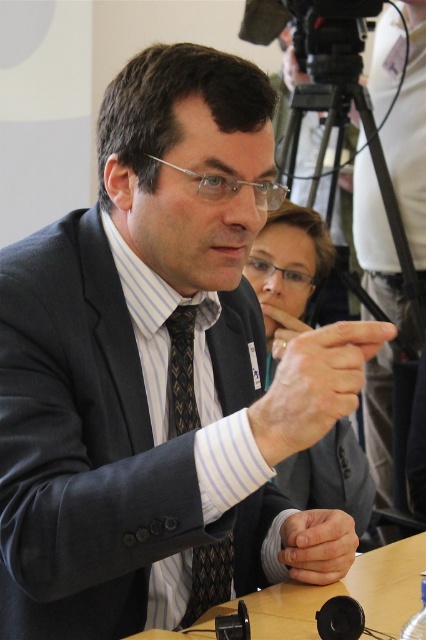
Based on the photo, you are a photographer at the event. You need to capture a closeup shot of the white matte hand at center and the black textured tie at center. Which object is wider in the photo?

The white matte hand at center is wider than the black textured tie at center.

You are a photographer at a conference. You need to capture a photo of the matte black suit at center and the smooth skin hands at center. Can you fit both subjects in the frame if the camera has a standard 50mm lens with a field of view that can capture objects up to 1.8 meters in height?

The matte black suit at center is much taller than the smooth skin hands at center. Since the camera can capture up to 1.8 meters in height and the matte black suit at center is the taller object, it will fit within the frame as long as both are positioned appropriately.

You are organizing a photo shoot and need to ensure that the black textured tie at center and the smooth skin hands at center are visible in the final image. Based on their sizes, which object should you focus on to ensure both are in frame?

The black textured tie at center has a lesser width compared to smooth skin hands at center, so you should focus on the smooth skin hands at center to ensure both are visible in the frame since it is wider and might require more space.